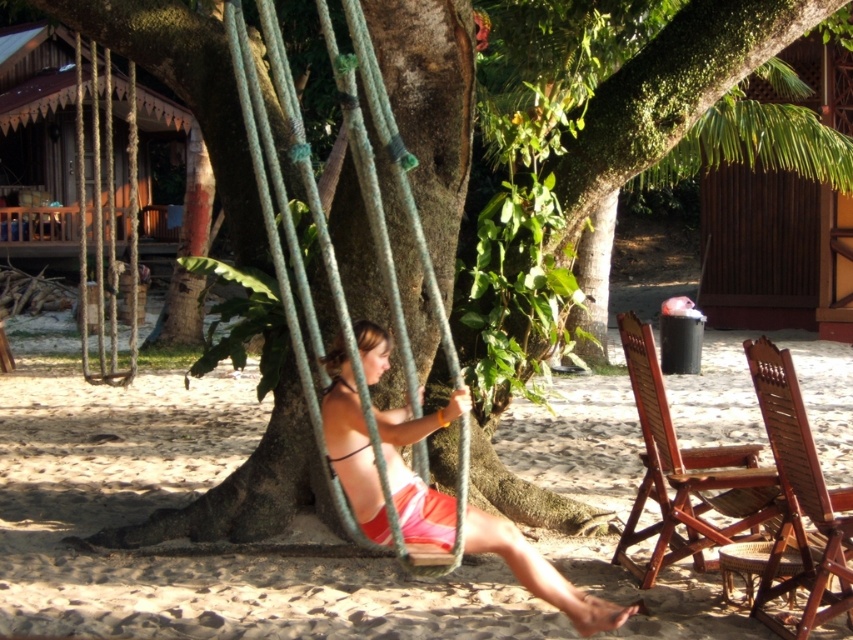
You are a photographer aiming to capture the matte black bikini top at center and the matte rope swing at center in a single shot. Based on their positions, which object should you focus on first to ensure both are in frame?

The matte rope swing at center is located below the matte black bikini top at center, so you should focus on the matte black bikini top at center first to ensure both are in frame.

You are standing at the camera position and want to take a photo of the matte rope swing at center. If your camera has a focal length of 50mm and you want to capture the entire swing in the frame without moving closer, what is the minimum sensor size required in millimeters to ensure the swing fits perfectly? Assume the swing is 1.2 meters wide and the sensor width is proportional to the focal length.

The matte rope swing at center is 7.19 meters away from the camera. To calculate the minimum sensor size, use the formula sensor width required equals object width multiplied by focal length divided by distance. Plugging in the numbers, 1.2 meters times 50mm divided by 7.19 meters equals approximately 8.34mm. Therefore, the sensor needs to be at least 8.34mm wide to capture the entire swing at 50mm focal length without moving closer.